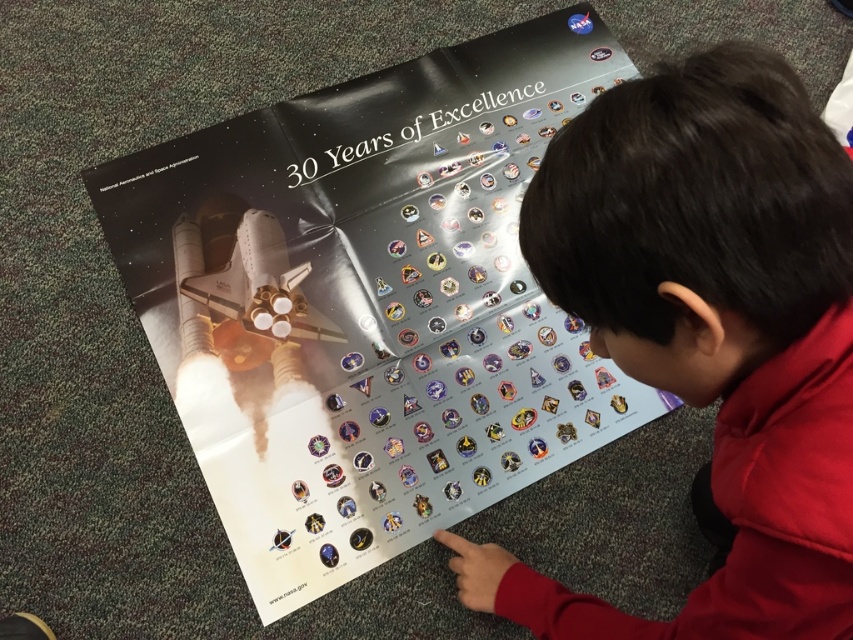
You are a photographer taking a picture of the metallic silver poster at center and the dark brown hair at upper center. Which object will appear larger in the photo?

The metallic silver poster at center will appear larger in the photo because it is closer to the viewer than the dark brown hair at upper center.

You are standing in a room and see the metallic silver poster at center. If you take one step forward, will the poster appear closer to you?

Yes, the metallic silver poster at center is currently 28.81 inches away from you. Taking a step forward will decrease the distance, making the poster appear closer.

In the scene shown: Based on the scene described, can you determine if the metallic silver poster at center is covering any part of the dark brown hair at upper center?

Yes, the metallic silver poster at center is positioned over dark brown hair at upper center, so it is covering part of the dark brown hair at upper center.